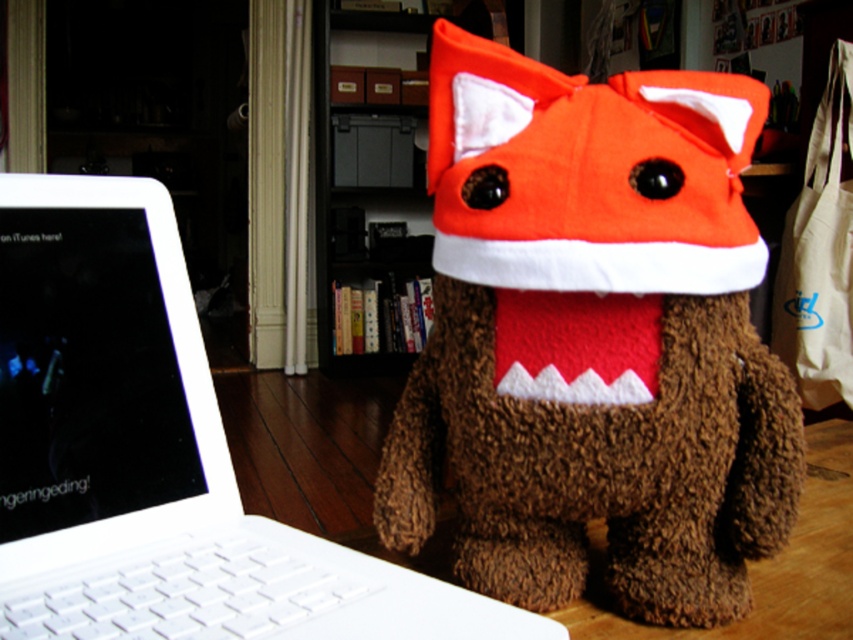
Question: Which object appears closest to the camera in this image?

Choices:
 (A) wooden bookshelf at center
 (B) white plastic laptop at lower left

Answer: (B)

Question: Can you confirm if white plastic laptop at lower left is positioned below wooden bookshelf at center?

Choices:
 (A) yes
 (B) no

Answer: (A)

Question: Which object is positioned closest to the brown fuzzy stuffed toy at center?

Choices:
 (A) orange plush hat at center
 (B) white plastic laptop at lower left

Answer: (A)

Question: Which point appears closest to the camera in this image?

Choices:
 (A) (358, 564)
 (B) (346, 368)
 (C) (483, 170)

Answer: (C)

Question: Does brown fuzzy stuffed toy at center come behind wooden bookshelf at center?

Choices:
 (A) yes
 (B) no

Answer: (B)

Question: Does white plastic laptop at lower left appear under wooden bookshelf at center?

Choices:
 (A) no
 (B) yes

Answer: (B)